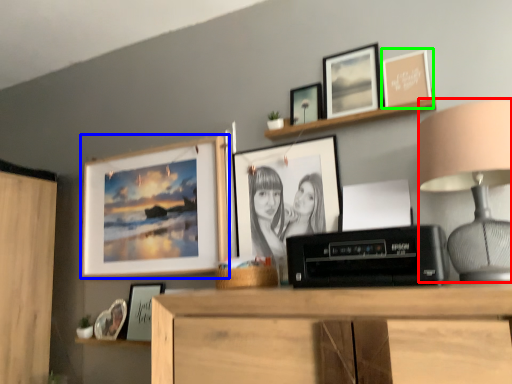
Question: Which object is positioned closest to table lamp (highlighted by a red box)? Select from picture frame (highlighted by a blue box) and picture frame (highlighted by a green box).

Choices:
 (A) picture frame
 (B) picture frame

Answer: (B)